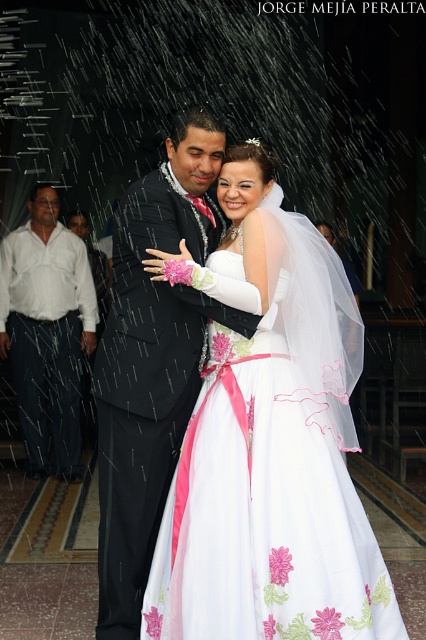
Who is positioned more to the left, white satin dress at center or matte black suit at center?

Positioned to the left is matte black suit at center.

Does white satin dress at center appear on the right side of matte black suit at center?

Correct, you'll find white satin dress at center to the right of matte black suit at center.

The width and height of the screenshot is (426, 640). What do you see at coordinates (264, 509) in the screenshot?
I see `white satin dress at center` at bounding box center [264, 509].

At what (x,y) coordinates should I click in order to perform the action: click on white satin dress at center. Please return your answer as a coordinate pair (x, y). This screenshot has height=640, width=426. Looking at the image, I should click on (264, 509).

Is matte black suit at center wider than white cotton shirt at left?

In fact, matte black suit at center might be narrower than white cotton shirt at left.

Does matte black suit at center have a lesser height compared to white cotton shirt at left?

No, matte black suit at center is not shorter than white cotton shirt at left.

Does point (114, 291) come closer to viewer compared to point (37, 205)?

Yes.

At what (x,y) coordinates should I click in order to perform the action: click on matte black suit at center. Please return your answer as a coordinate pair (x, y). The width and height of the screenshot is (426, 640). Looking at the image, I should click on (150, 360).

Does white satin dress at center appear on the left side of white cotton shirt at left?

In fact, white satin dress at center is to the right of white cotton shirt at left.

Who is positioned more to the right, white satin dress at center or white cotton shirt at left?

From the viewer's perspective, white satin dress at center appears more on the right side.

Locate an element on the screen. This screenshot has height=640, width=426. white satin dress at center is located at coordinates (264, 509).